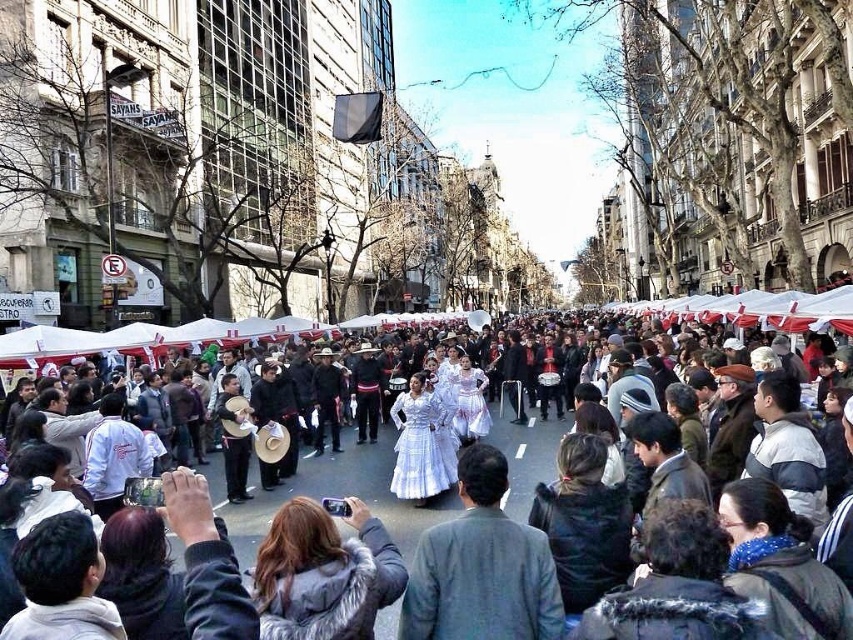
From the picture: You are a photographer standing in the crowd and want to take a photo of both the white lace dress at center and the white cotton dress at center. Which dress should you focus on first to ensure both are in the frame?

You should focus on the white lace dress at center first since it is closer to the viewer, ensuring both dresses are in the frame by adjusting the camera angle to include the white cotton dress at center behind it.

You are a photographer at the event and want to capture both the white lace dress at center and the white cotton dress at center in a single frame. Since the dresses are very close to each other, which dress will appear thinner in the photo?

The white lace dress at center is thinner than the white cotton dress at center, so it will appear thinner in the photo.

You are standing on the street and want to take a photo of the point at coordinates (526, 556). The camera you have can focus on objects up to 50 meters away. Will the point be in focus?

The distance of point (526, 556) from the viewer is 52.78 meters, which is beyond the camera focus limit of 50 meters. Therefore, the point will not be in focus.